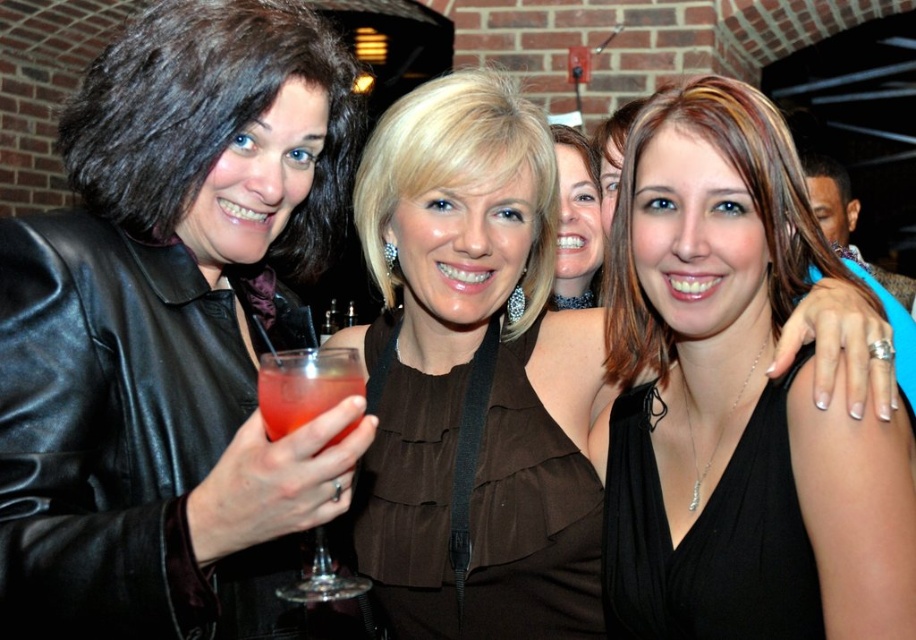
Question: Which object is farther from the camera taking this photo?

Choices:
 (A) translucent glass drink at center
 (B) translucent glass at left
 (C) matte black leather jacket at left
 (D) black leather jacket at left

Answer: (C)

Question: Which object is farther from the camera taking this photo?

Choices:
 (A) matte brown blouse at center
 (B) matte black leather jacket at left

Answer: (A)

Question: Which point appears farthest from the camera in this image?

Choices:
 (A) (269, 218)
 (B) (324, 168)
 (C) (582, 154)
 (D) (270, 424)

Answer: (C)

Question: Can you confirm if matte black leather jacket at left is positioned to the right of translucent glass drink at center?

Choices:
 (A) yes
 (B) no

Answer: (B)

Question: Can you confirm if black satin dress at center is positioned to the right of matte brown blouse at center?

Choices:
 (A) yes
 (B) no

Answer: (A)

Question: From the image, what is the correct spatial relationship of black leather jacket at left in relation to black satin dress at center?

Choices:
 (A) below
 (B) above

Answer: (B)